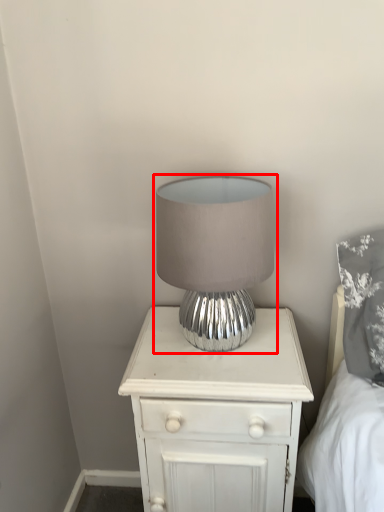
Question: From the image's perspective, where is lamp (annotated by the red box) located relative to nightstand?

Choices:
 (A) above
 (B) below

Answer: (A)